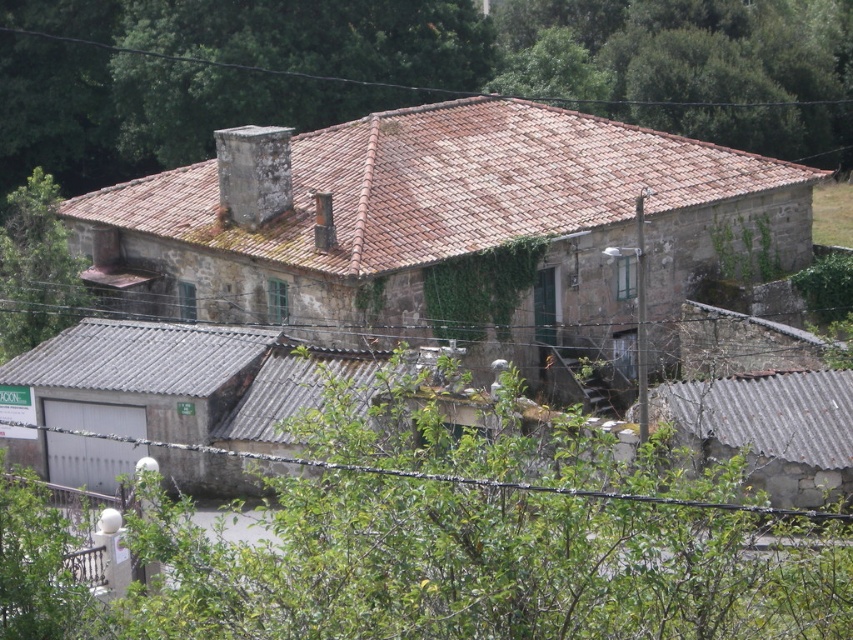
Is brown tile roof at upper center further to the viewer compared to green leafy tree at upper left?

Yes, brown tile roof at upper center is further from the viewer.

Can you confirm if brown tile roof at upper center is positioned above green leafy tree at upper left?

Correct, brown tile roof at upper center is located above green leafy tree at upper left.

Does point (161, 10) come closer to viewer compared to point (13, 257)?

No, it is behind (13, 257).

This screenshot has width=853, height=640. Find the location of `brown tile roof at upper center`. brown tile roof at upper center is located at coordinates (485, 38).